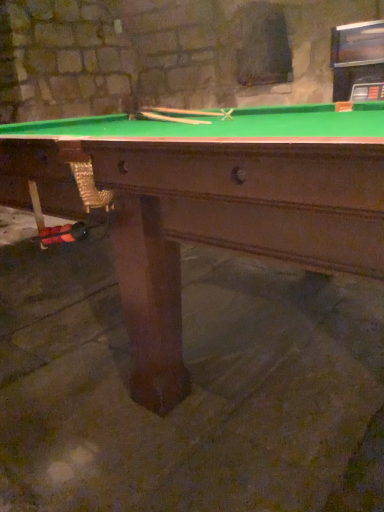
Question: Is wooden cue at center, the second cue ordered from the bottom, surrounding green felt pool table at center?

Choices:
 (A) yes
 (B) no

Answer: (B)

Question: Is wooden cue at center, the first cue in the top-to-bottom sequence, smaller than green felt pool table at center?

Choices:
 (A) yes
 (B) no

Answer: (A)

Question: From a real-world perspective, is wooden cue at center, the second cue ordered from the bottom, positioned over green felt pool table at center based on gravity?

Choices:
 (A) yes
 (B) no

Answer: (A)

Question: Is wooden cue at center, the first cue in the top-to-bottom sequence, facing away from green felt pool table at center?

Choices:
 (A) yes
 (B) no

Answer: (A)

Question: Is wooden cue at center, the first cue in the top-to-bottom sequence, taller than green felt pool table at center?

Choices:
 (A) no
 (B) yes

Answer: (A)

Question: Does wooden cue at center, the second cue ordered from the bottom, come behind green felt pool table at center?

Choices:
 (A) no
 (B) yes

Answer: (B)

Question: From the image's perspective, is wooden cue at center, the first cue when ordered from bottom to top, located above wooden cue at center, the first cue in the top-to-bottom sequence?

Choices:
 (A) yes
 (B) no

Answer: (B)

Question: Is wooden cue at center, the second cue ordered from the bottom, a part of wooden cue at center, the first cue when ordered from bottom to top?

Choices:
 (A) no
 (B) yes

Answer: (A)

Question: Is wooden cue at center, which ranks as the 2th cue in top-to-bottom order, to the left of wooden cue at center, the first cue in the top-to-bottom sequence, from the viewer's perspective?

Choices:
 (A) yes
 (B) no

Answer: (A)

Question: Is wooden cue at center, which ranks as the 2th cue in top-to-bottom order, further to the viewer compared to wooden cue at center, the second cue ordered from the bottom?

Choices:
 (A) no
 (B) yes

Answer: (A)

Question: Is wooden cue at center, the first cue in the top-to-bottom sequence, at the back of wooden cue at center, which ranks as the 2th cue in top-to-bottom order?

Choices:
 (A) no
 (B) yes

Answer: (A)

Question: Is wooden cue at center, which ranks as the 2th cue in top-to-bottom order, completely or partially outside of wooden cue at center, the first cue in the top-to-bottom sequence?

Choices:
 (A) yes
 (B) no

Answer: (A)

Question: Is green felt pool table at center smaller than wooden cue at center, which ranks as the 2th cue in top-to-bottom order?

Choices:
 (A) yes
 (B) no

Answer: (B)